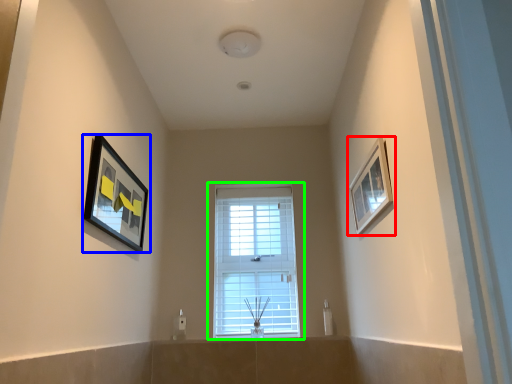
Question: Based on their relative distances, which object is nearer to picture frame (highlighted by a red box)? Choose from picture frame (highlighted by a blue box) and window (highlighted by a green box).

Choices:
 (A) picture frame
 (B) window

Answer: (B)